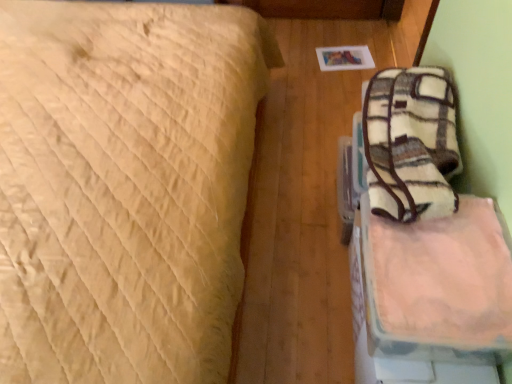
At what (x,y) coordinates should I click in order to perform the action: click on beige quilted bed at upper left. Please return your answer as a coordinate pair (x, y). The width and height of the screenshot is (512, 384). Looking at the image, I should click on (124, 187).

What is the approximate width of beige quilted bed at upper left?

beige quilted bed at upper left is 1.47 meters wide.

What do you see at coordinates (124, 187) in the screenshot?
I see `beige quilted bed at upper left` at bounding box center [124, 187].

This screenshot has height=384, width=512. What do you see at coordinates (440, 278) in the screenshot? I see `pink fabric bag at right` at bounding box center [440, 278].

Locate an element on the screen. The width and height of the screenshot is (512, 384). pink fabric bag at right is located at coordinates (440, 278).

Find the location of a particular element. The image size is (512, 384). beige quilted bed at upper left is located at coordinates (124, 187).

Between beige quilted bed at upper left and pink fabric bag at right, which one appears on the left side from the viewer's perspective?

beige quilted bed at upper left.

Does beige quilted bed at upper left lie in front of pink fabric bag at right?

Yes.

Is point (191, 231) closer or farther from the camera than point (446, 229)?

Point (191, 231).

From the image's perspective, is beige quilted bed at upper left located above pink fabric bag at right?

Yes, from the image's perspective, beige quilted bed at upper left is over pink fabric bag at right.

From a real-world perspective, which object stands above the other?

beige quilted bed at upper left, from a real-world perspective.

In the scene shown: Considering the sizes of objects beige quilted bed at upper left and pink fabric bag at right in the image provided, who is thinner, beige quilted bed at upper left or pink fabric bag at right?

pink fabric bag at right is thinner.

Which of these two, beige quilted bed at upper left or pink fabric bag at right, stands shorter?

pink fabric bag at right is shorter.

Considering the sizes of beige quilted bed at upper left and pink fabric bag at right in the image, is beige quilted bed at upper left bigger or smaller than pink fabric bag at right?

Considering their sizes, beige quilted bed at upper left takes up more space than pink fabric bag at right.

In the scene shown: Is pink fabric bag at right a part of beige quilted bed at upper left?

Definitely not — pink fabric bag at right is not inside beige quilted bed at upper left.

Are beige quilted bed at upper left and pink fabric bag at right making contact?

They are not placed beside each other.

Could you tell me if beige quilted bed at upper left is facing pink fabric bag at right?

Yes, beige quilted bed at upper left is turned towards pink fabric bag at right.

How different are the orientations of beige quilted bed at upper left and pink fabric bag at right in degrees?

180 degrees separate the facing orientations of beige quilted bed at upper left and pink fabric bag at right.

Measure the distance from beige quilted bed at upper left to pink fabric bag at right.

beige quilted bed at upper left is 25.29 inches from pink fabric bag at right.

You are a GUI agent. You are given a task and a screenshot of the screen. Output one action in this format:
    pyautogui.click(x=<x>, y=<y>)
    Task: Click on the bed located on the left of pink fabric bag at right
    The width and height of the screenshot is (512, 384).
    Given the screenshot: What is the action you would take?
    pyautogui.click(x=124, y=187)

Considering the relative positions of pink fabric bag at right and beige quilted bed at upper left in the image provided, is pink fabric bag at right to the left or to the right of beige quilted bed at upper left?

Based on their positions, pink fabric bag at right is located to the right of beige quilted bed at upper left.

Is pink fabric bag at right in front of beige quilted bed at upper left?

That is False.

Which is closer, [488,283] or [95,109]?

Point [488,283]

From the image's perspective, which one is positioned higher, pink fabric bag at right or beige quilted bed at upper left?

beige quilted bed at upper left is shown above in the image.

From a real-world perspective, which object rests below the other?

pink fabric bag at right is physically lower.

Is pink fabric bag at right wider than beige quilted bed at upper left?

No, pink fabric bag at right is not wider than beige quilted bed at upper left.

In terms of height, does pink fabric bag at right look taller or shorter compared to beige quilted bed at upper left?

Considering their sizes, pink fabric bag at right has less height than beige quilted bed at upper left.

Who is smaller, pink fabric bag at right or beige quilted bed at upper left?

pink fabric bag at right.

Is pink fabric bag at right surrounding beige quilted bed at upper left?

No, beige quilted bed at upper left is not a part of pink fabric bag at right.

Is pink fabric bag at right not close to beige quilted bed at upper left?

That's not correct — pink fabric bag at right is a little close to beige quilted bed at upper left.

Looking at this image, could you tell me if pink fabric bag at right is facing beige quilted bed at upper left?

Yes, pink fabric bag at right is facing beige quilted bed at upper left.

How different are the orientations of pink fabric bag at right and beige quilted bed at upper left in degrees?

The angle between the facing direction of pink fabric bag at right and the facing direction of beige quilted bed at upper left is 180 degrees.

Find the location of `bed on the left of pink fabric bag at right`. bed on the left of pink fabric bag at right is located at coordinates (124, 187).

Where is `bed above the pink fabric bag at right (from a real-world perspective)`? The width and height of the screenshot is (512, 384). bed above the pink fabric bag at right (from a real-world perspective) is located at coordinates (124, 187).

Locate an element on the screen. This screenshot has height=384, width=512. sheet located on the right of beige quilted bed at upper left is located at coordinates (440, 278).